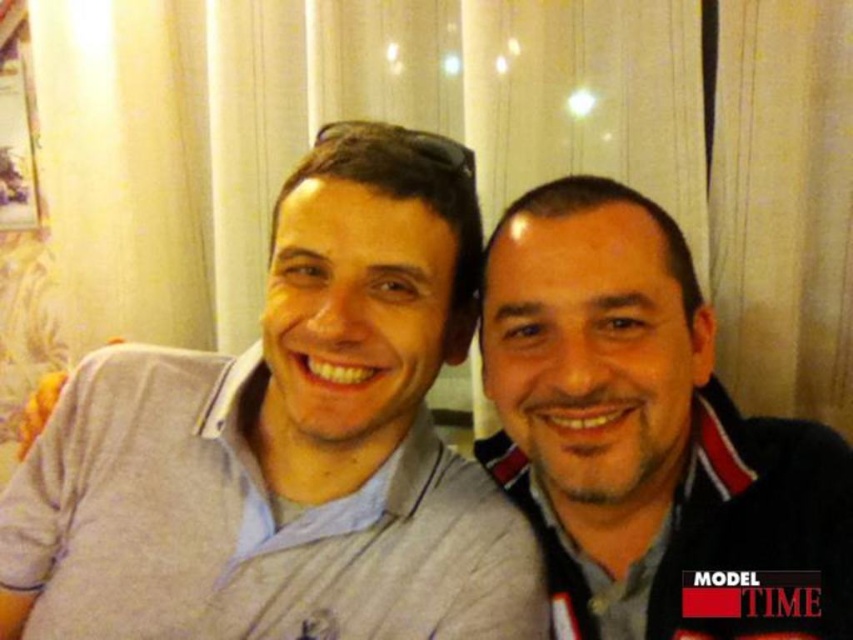
Question: Can you confirm if gray cotton shirt at left is bigger than matte black jacket at right?

Choices:
 (A) no
 (B) yes

Answer: (B)

Question: Does gray cotton shirt at left have a larger size compared to matte black jacket at right?

Choices:
 (A) yes
 (B) no

Answer: (A)

Question: Among these objects, which one is farthest from the camera?

Choices:
 (A) gray cotton shirt at left
 (B) matte black jacket at right

Answer: (A)

Question: Is gray cotton shirt at left closer to the viewer compared to matte black jacket at right?

Choices:
 (A) no
 (B) yes

Answer: (A)